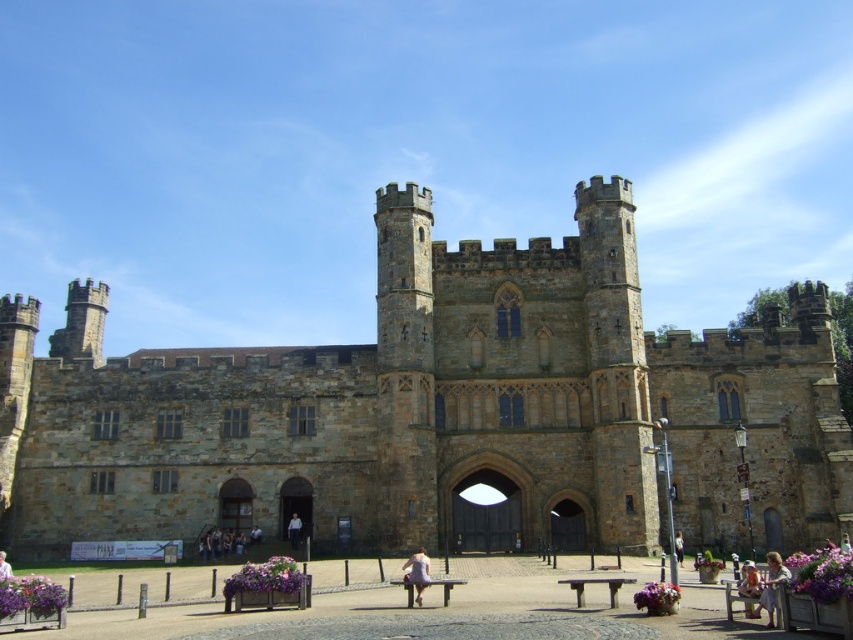
Question: Can you confirm if brown stone castle at center is smaller than light brown hair at lower right?

Choices:
 (A) no
 (B) yes

Answer: (A)

Question: Among these objects, which one is farthest from the camera?

Choices:
 (A) light blue fabric dress at lower left
 (B) brown stone castle at center
 (C) light purple fabric dress at center

Answer: (B)

Question: Among these points, which one is nearest to the camera?

Choices:
 (A) (3, 564)
 (B) (680, 540)
 (C) (762, 609)

Answer: (C)

Question: Which of the following is the closest to the observer?

Choices:
 (A) (738, 586)
 (B) (427, 570)
 (C) (677, 547)

Answer: (B)

Question: Does brown stone castle at center appear under light blue fabric dress at lower left?

Choices:
 (A) no
 (B) yes

Answer: (A)

Question: Does light purple fabric dress at center have a greater width compared to light blue fabric dress at lower left?

Choices:
 (A) no
 (B) yes

Answer: (A)